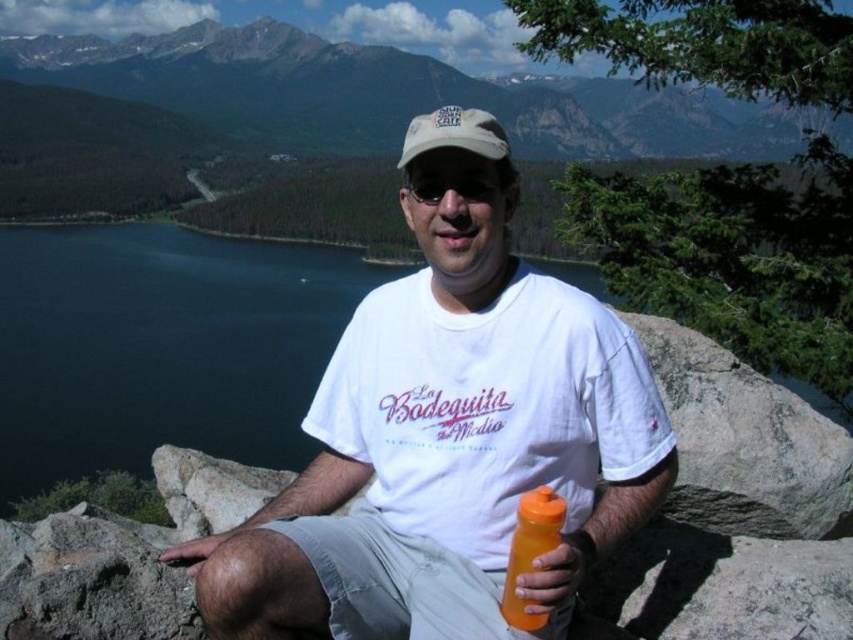
Does white cotton t-shirt at center appear on the right side of black matte sunglasses at center?

No, white cotton t-shirt at center is not to the right of black matte sunglasses at center.

Which of these two, white cotton t-shirt at center or black matte sunglasses at center, stands taller?

white cotton t-shirt at center is taller.

This screenshot has height=640, width=853. I want to click on white cotton t-shirt at center, so click(x=447, y=449).

Image resolution: width=853 pixels, height=640 pixels. I want to click on white cotton t-shirt at center, so click(447, 449).

Between orange matte bottle at lower center and black matte sunglasses at center, which one is positioned higher?

Positioned higher is black matte sunglasses at center.

Can you confirm if orange matte bottle at lower center is thinner than black matte sunglasses at center?

Indeed, orange matte bottle at lower center has a lesser width compared to black matte sunglasses at center.

Who is more distant from viewer, (x=515, y=584) or (x=465, y=177)?

The point (x=465, y=177) is behind.

Identify the location of orange matte bottle at lower center. The image size is (853, 640). (531, 552).

Is point (363, 51) in front of point (421, 138)?

No, (363, 51) is behind (421, 138).

Is rocky mountain range at upper center bigger than white fabric cap at center?

Indeed, rocky mountain range at upper center has a larger size compared to white fabric cap at center.

What do you see at coordinates (397, 93) in the screenshot? I see `rocky mountain range at upper center` at bounding box center [397, 93].

Locate an element on the screen. rocky mountain range at upper center is located at coordinates point(397,93).